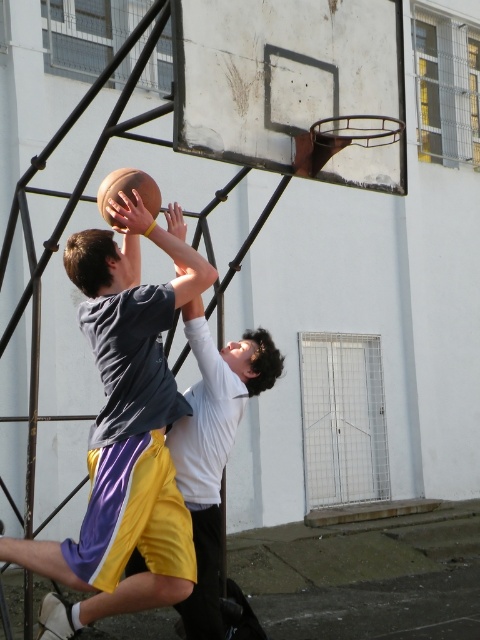
Question: Does matte gray shirt at center have a smaller size compared to rubber textured basketball at center?

Choices:
 (A) yes
 (B) no

Answer: (B)

Question: Observing the image, what is the correct spatial positioning of matte gray shirt at center in reference to rubber textured basketball at center?

Choices:
 (A) above
 (B) below

Answer: (B)

Question: Can you confirm if matte gray shirt at center is wider than rubber textured basketball at center?

Choices:
 (A) yes
 (B) no

Answer: (A)

Question: Which object is closer to the camera taking this photo?

Choices:
 (A) matte gray shirt at center
 (B) rubber textured basketball at center

Answer: (A)